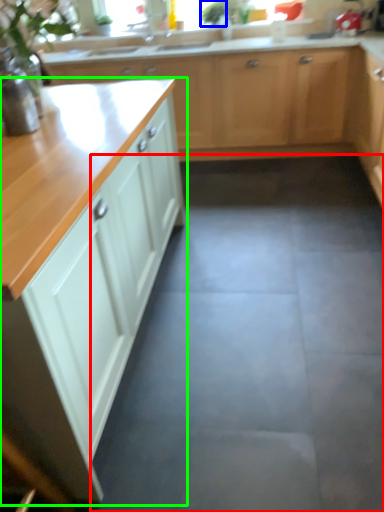
Question: Which is farther away from concrete (highlighted by a red box)? plant (highlighted by a blue box) or cabinetry (highlighted by a green box)?

Choices:
 (A) plant
 (B) cabinetry

Answer: (A)